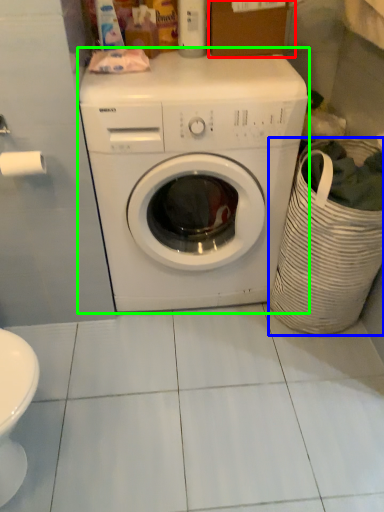
Question: Which object is positioned farthest from cardboard box (highlighted by a red box)? Select from laundry basket (highlighted by a blue box) and washing machine (highlighted by a green box).

Choices:
 (A) laundry basket
 (B) washing machine

Answer: (A)